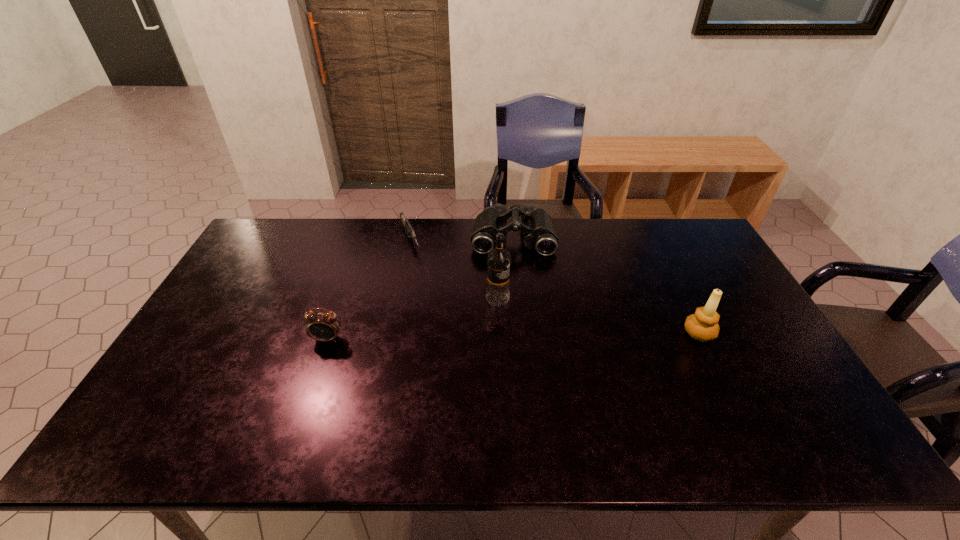
The image size is (960, 540). Identify the location of alarm clock. (322, 326).

At what (x,y) coordinates should I click in order to perform the action: click on the second tallest object. Please return your answer as a coordinate pair (x, y). Image resolution: width=960 pixels, height=540 pixels. Looking at the image, I should click on (703, 325).

Where is `the rightmost object`? This screenshot has height=540, width=960. the rightmost object is located at coordinates (703, 325).

This screenshot has width=960, height=540. I want to click on the third nearest object, so click(498, 260).

I want to click on vodka, so click(x=498, y=260).

This screenshot has width=960, height=540. What are the coordinates of `binoculars` in the screenshot? It's located at (537, 225).

Locate an element on the screen. The width and height of the screenshot is (960, 540). the shortest object is located at coordinates (411, 234).

Where is `gun`? The width and height of the screenshot is (960, 540). gun is located at coordinates (411, 234).

The width and height of the screenshot is (960, 540). Find the location of `free space located on the face of the alarm clock`. free space located on the face of the alarm clock is located at coordinates (310, 391).

This screenshot has width=960, height=540. In order to click on vacant space located on the left of the fourth shortest object in this screenshot , I will do `click(571, 333)`.